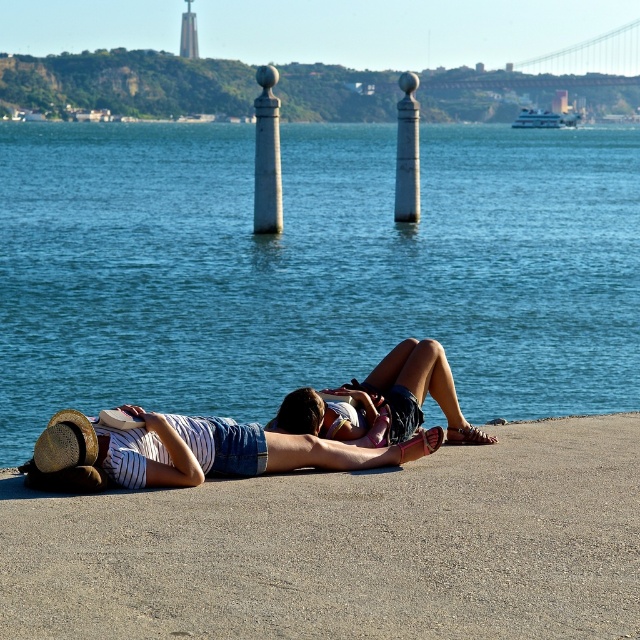
Describe the element at coordinates (310, 268) in the screenshot. I see `blue water at center` at that location.

Is blue water at center above white glossy post at center?

No, blue water at center is not above white glossy post at center.

Where is `blue water at center`? The width and height of the screenshot is (640, 640). blue water at center is located at coordinates (310, 268).

You are a GUI agent. You are given a task and a screenshot of the screen. Output one action in this format:
    pyautogui.click(x=<x>, y=<y>)
    Task: Click on the blue water at center
    This screenshot has width=640, height=640.
    Given the screenshot: What is the action you would take?
    pyautogui.click(x=310, y=268)

Is blue water at center to the left of smooth concrete dock at lower center from the viewer's perspective?

In fact, blue water at center is to the right of smooth concrete dock at lower center.

At what (x,y) coordinates should I click in order to perform the action: click on blue water at center. Please return your answer as a coordinate pair (x, y). Looking at the image, I should click on (310, 268).

Is point (497, 326) closer to camera compared to point (532, 449)?

No, (497, 326) is further to viewer.

You are a GUI agent. You are given a task and a screenshot of the screen. Output one action in this format:
    pyautogui.click(x=<x>, y=<y>)
    Task: Click on the blue water at center
    The height and width of the screenshot is (640, 640).
    Given the screenshot: What is the action you would take?
    pyautogui.click(x=310, y=268)

Is white stone post at center below brown straw hat at lower left?

Incorrect, white stone post at center is not positioned below brown straw hat at lower left.

Between white stone post at center and brown straw hat at lower left, which one has more height?

With more height is white stone post at center.

Is point (266, 92) positioned after point (80, 452)?

Yes.

The height and width of the screenshot is (640, 640). I want to click on white stone post at center, so click(266, 156).